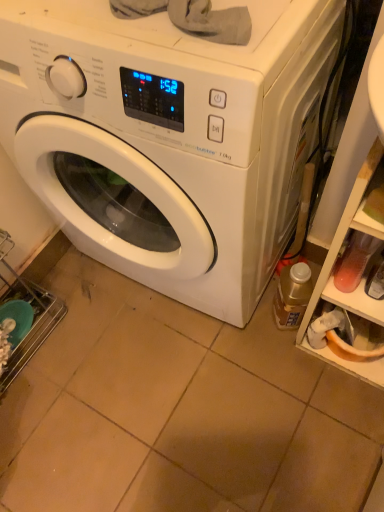
You are a GUI agent. You are given a task and a screenshot of the screen. Output one action in this format:
    pyautogui.click(x=<x>, y=<y>)
    Task: Click on the free space in front of translucent plastic bottle at lower right
    The image size is (384, 512).
    Given the screenshot: What is the action you would take?
    pyautogui.click(x=294, y=373)